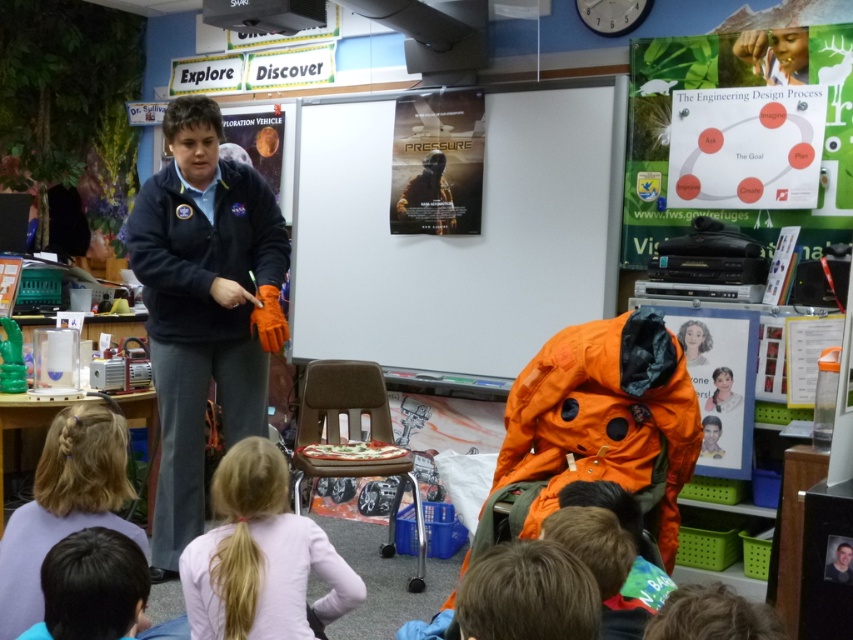
Question: Considering the real-world distances, which object is closest to the matte orange poster at center?

Choices:
 (A) pink fabric shirt at lower center
 (B) navy blue fleece jacket at center
 (C) blonde hair at lower left

Answer: (B)

Question: Which point is closer to the camera taking this photo?

Choices:
 (A) (196, 285)
 (B) (326, 260)
 (C) (115, 444)
 (D) (270, 515)

Answer: (C)

Question: Is pink fabric shirt at lower center behind blonde hair at lower left?

Choices:
 (A) no
 (B) yes

Answer: (B)

Question: Does matte orange poster at center come in front of pink fabric shirt at lower center?

Choices:
 (A) yes
 (B) no

Answer: (B)

Question: Which point is farther to the camera?

Choices:
 (A) matte orange poster at center
 (B) blonde hair at lower left

Answer: (A)

Question: Is navy blue fleece jacket at center thinner than blonde hair at lower left?

Choices:
 (A) no
 (B) yes

Answer: (A)